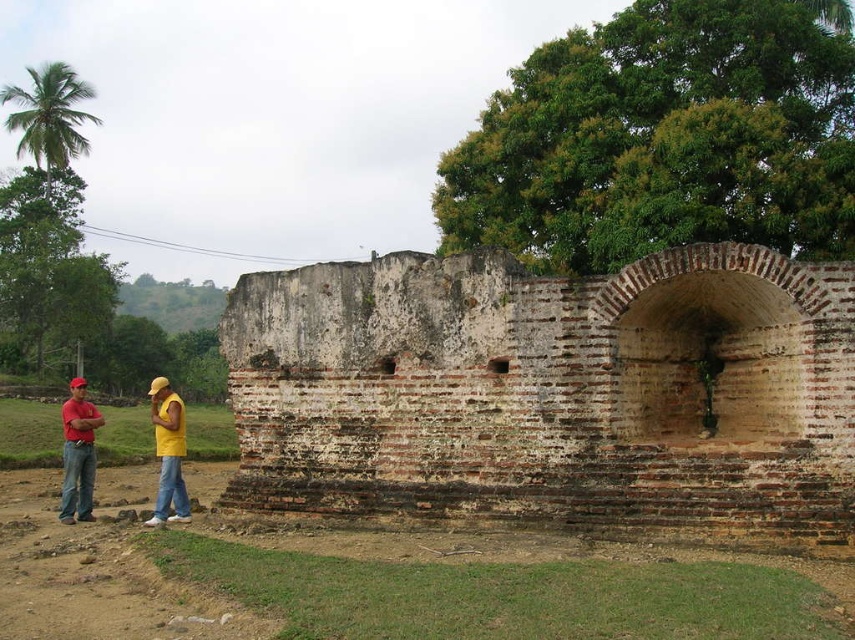
Question: Estimate the real-world distances between objects in this image. Which object is farther from the weathered brick wall at center?

Choices:
 (A) matte red cap at left
 (B) yellow t-shirt at lower left
 (C) yellow cotton shirt at center

Answer: (A)

Question: Which object is the farthest from the matte red cap at left?

Choices:
 (A) yellow cotton shirt at center
 (B) yellow t-shirt at lower left
 (C) weathered brick wall at center

Answer: (C)

Question: Observing the image, what is the correct spatial positioning of matte red cap at left in reference to yellow cotton shirt at center?

Choices:
 (A) above
 (B) below

Answer: (A)

Question: Is weathered brick wall at center closer to the viewer compared to matte red cap at left?

Choices:
 (A) no
 (B) yes

Answer: (B)

Question: Among these points, which one is farthest from the camera?

Choices:
 (A) (848, 484)
 (B) (86, 417)
 (C) (162, 518)

Answer: (B)

Question: Is weathered brick wall at center smaller than matte red cap at left?

Choices:
 (A) yes
 (B) no

Answer: (A)